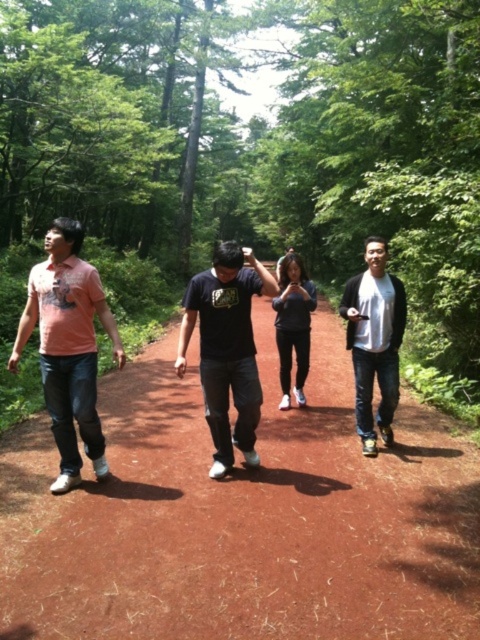
Question: Which of the following is the closest to the observer?

Choices:
 (A) black matte jacket at right
 (B) brown dirt path at center
 (C) matte pink shirt at left

Answer: (B)

Question: Is matte pink shirt at left bigger than black matte shirt at center?

Choices:
 (A) yes
 (B) no

Answer: (B)

Question: Can you confirm if brown dirt path at center is wider than matte pink shirt at left?

Choices:
 (A) yes
 (B) no

Answer: (A)

Question: Which point is farther from the camera taking this photo?

Choices:
 (A) (51, 404)
 (B) (359, 401)

Answer: (B)

Question: Does brown dirt path at center have a greater width compared to black matte jacket at right?

Choices:
 (A) yes
 (B) no

Answer: (A)

Question: Which of these objects is positioned closest to the brown dirt path at center?

Choices:
 (A) matte pink shirt at left
 (B) dark gray fabric pants at center
 (C) black matte jacket at right

Answer: (A)